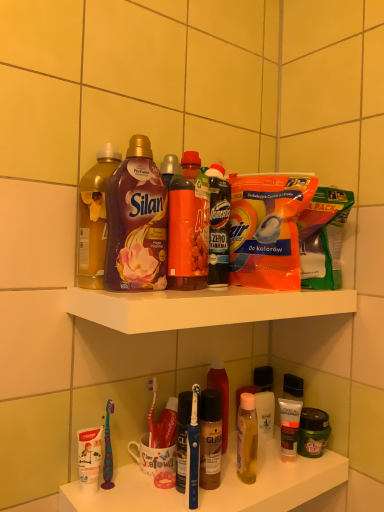
The height and width of the screenshot is (512, 384). Find the location of `free region under white plastic shelf at upper center (from a real-world perspective)`. free region under white plastic shelf at upper center (from a real-world perspective) is located at coordinates (222, 472).